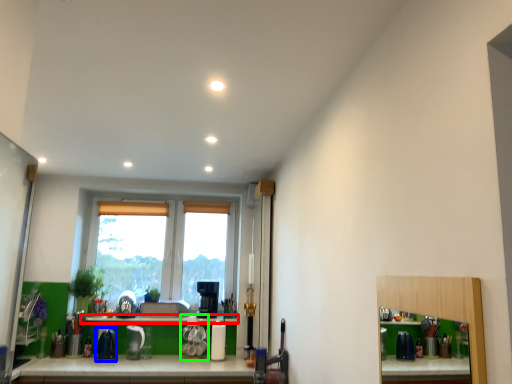
Question: Based on their relative distances, which object is farther from window sill (highlighted by a red box)? Choose from appliance (highlighted by a blue box) and appliance (highlighted by a green box).

Choices:
 (A) appliance
 (B) appliance

Answer: (A)